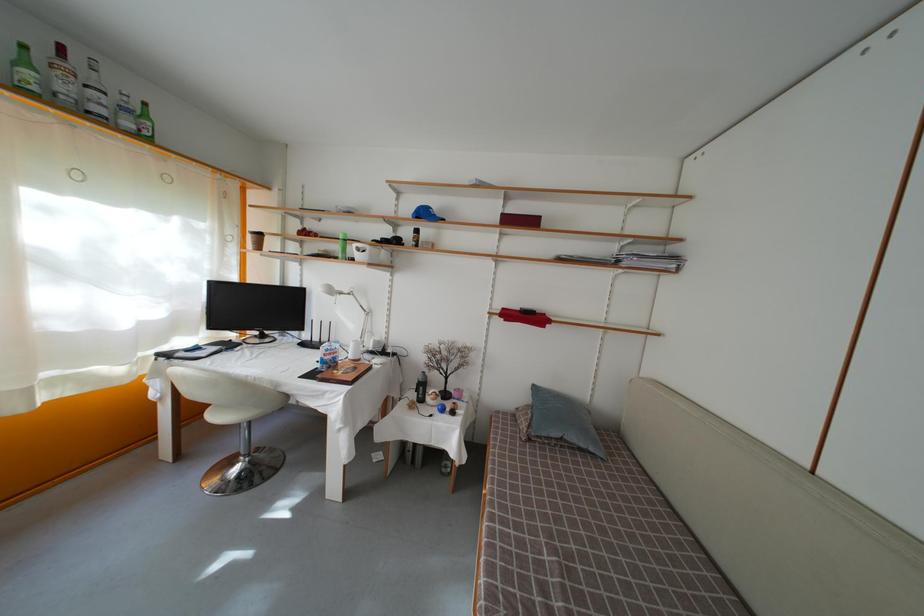
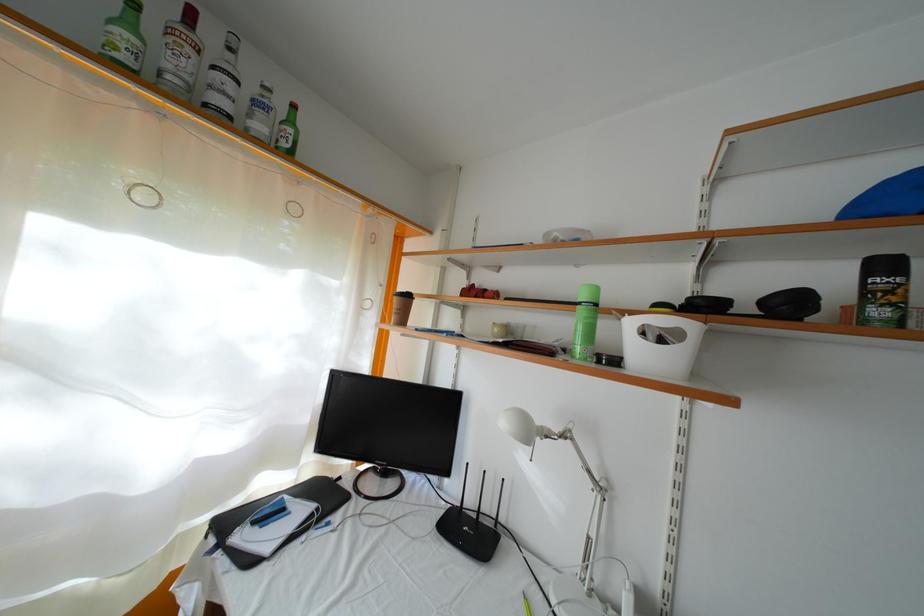
Where in the second image is the point corresponding to [31,69] from the first image?

(134, 31)